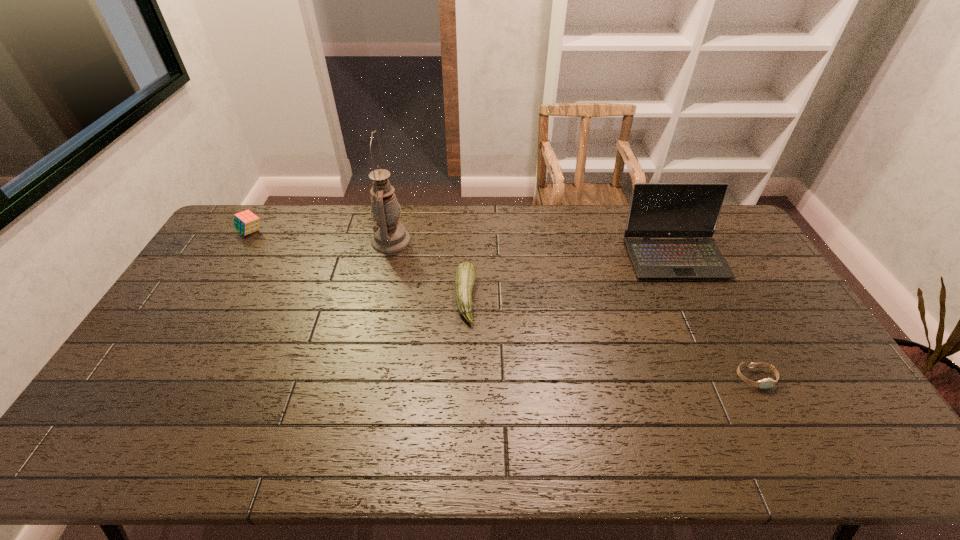
Find the location of a particular element. free space between the tallest object and the watch is located at coordinates (573, 309).

Locate an element on the screen. empty space that is in between the fourth tallest object and the watch is located at coordinates (611, 338).

Locate an element on the screen. This screenshot has height=540, width=960. free spot between the oil lamp and the second shortest object is located at coordinates (428, 269).

The width and height of the screenshot is (960, 540). Identify the location of free space between the oil lamp and the fourth shortest object. (533, 248).

Locate an element on the screen. Image resolution: width=960 pixels, height=540 pixels. vacant area that lies between the third object from right to left and the leftmost object is located at coordinates (358, 265).

Locate an element on the screen. Image resolution: width=960 pixels, height=540 pixels. the fourth closest object to the third shortest object is located at coordinates (768, 382).

Where is `object that stands as the third closest to the watch`? This screenshot has height=540, width=960. object that stands as the third closest to the watch is located at coordinates (389, 236).